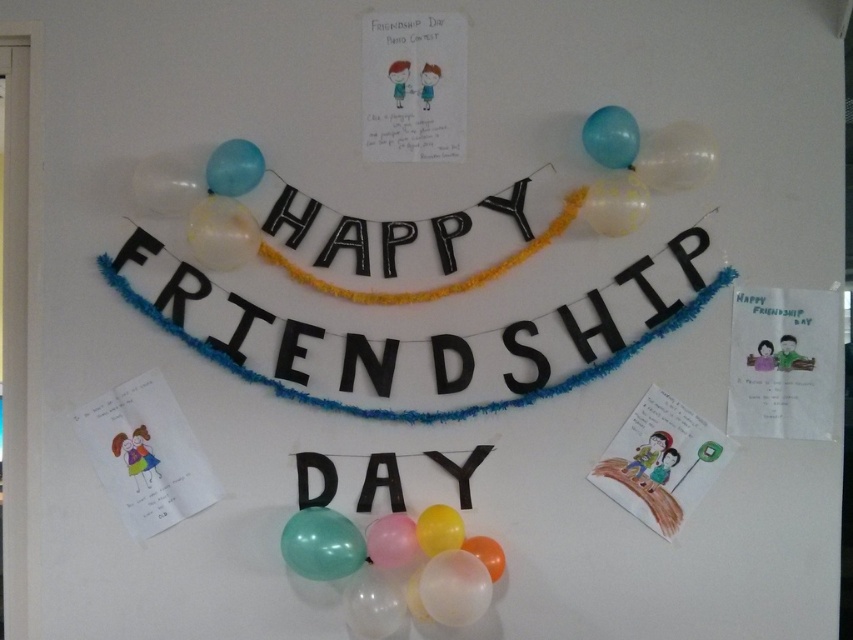
You are planning to hang a new decoration between the black paper letters at center and the translucent glossy balloon at upper left. The decoration requires 12 inches of space. Is there enough space between them?

The distance between the black paper letters at center and the translucent glossy balloon at upper left is 13.25 inches, which is more than the required 12 inches. Therefore, there is enough space to hang the decoration between them.

You are organizing a Friendship Day event and need to place a decorative star exactly in the center of the black paper letters at center. What are the coordinates where you should place the star?

The coordinates to place the decorative star exactly in the center of the black paper letters at center are at point (416, 339).